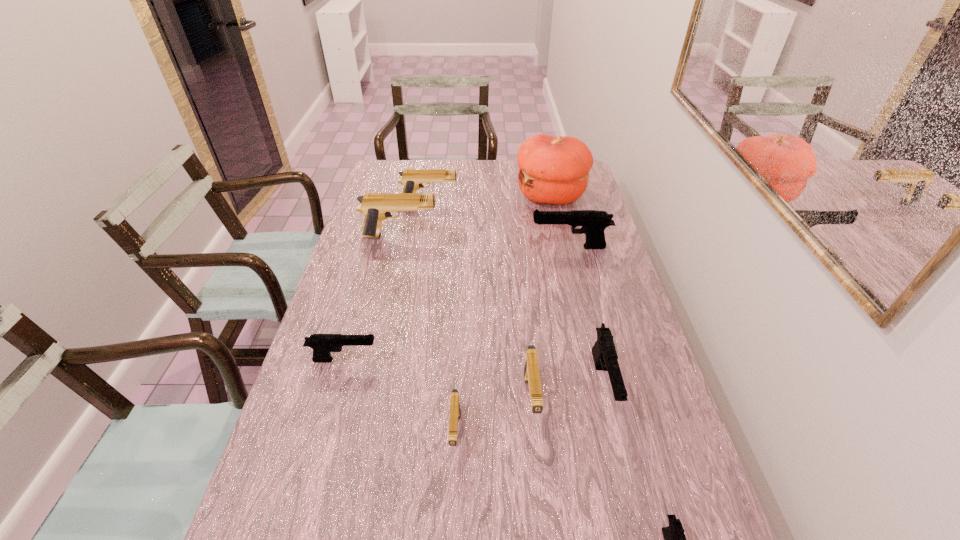
Identify the location of vacant space located 0.100m at the barrel of the fifth pistol from left to right. This screenshot has width=960, height=540. (539, 478).

The height and width of the screenshot is (540, 960). Identify the location of vacant space situated on the front-facing side of the third biggest black pistol. (440, 360).

At what (x,y) coordinates should I click in order to perform the action: click on vacant space located at the barrel of the second tan pistol from right to left. Please return your answer as a coordinate pair (x, y). Looking at the image, I should click on (452, 489).

Where is `object at the far edge`? The width and height of the screenshot is (960, 540). object at the far edge is located at coordinates (554, 170).

Locate an element on the screen. pumpkin situated at the right edge is located at coordinates (554, 170).

Locate an element on the screen. The width and height of the screenshot is (960, 540). object at the far right corner is located at coordinates (554, 170).

The height and width of the screenshot is (540, 960). In the image, there is a desktop. In order to click on vacant space at the far edge in this screenshot , I will do `click(489, 166)`.

Locate an element on the screen. This screenshot has width=960, height=540. vacant space at the left edge of the desktop is located at coordinates (307, 431).

Locate an element on the screen. The height and width of the screenshot is (540, 960). vacant space at the right edge is located at coordinates (588, 295).

The width and height of the screenshot is (960, 540). In order to click on free spot at the far right corner of the desktop in this screenshot , I will do `click(588, 185)`.